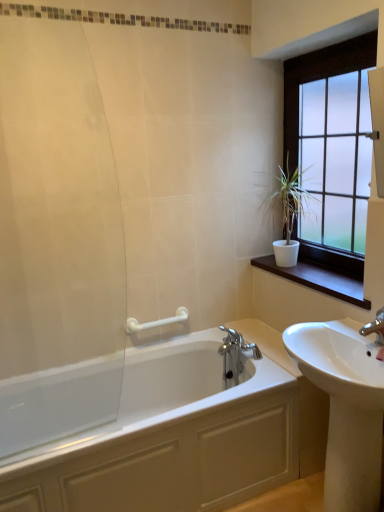
Question: Is white glossy bathtub at lower left not inside white wood at right?

Choices:
 (A) yes
 (B) no

Answer: (A)

Question: Considering the relative sizes of white glossy bathtub at lower left and white wood at right in the image provided, is white glossy bathtub at lower left bigger than white wood at right?

Choices:
 (A) no
 (B) yes

Answer: (B)

Question: Is white glossy bathtub at lower left wider than white wood at right?

Choices:
 (A) yes
 (B) no

Answer: (A)

Question: From a real-world perspective, is white glossy bathtub at lower left below white wood at right?

Choices:
 (A) no
 (B) yes

Answer: (B)

Question: Can you confirm if white glossy bathtub at lower left is positioned to the left of white wood at right?

Choices:
 (A) yes
 (B) no

Answer: (A)

Question: Does white glossy bathtub at lower left come in front of white wood at right?

Choices:
 (A) no
 (B) yes

Answer: (B)

Question: Is transparent glass shower door at left to the right of satin glass window at upper right from the viewer's perspective?

Choices:
 (A) no
 (B) yes

Answer: (A)

Question: Considering the relative sizes of transparent glass shower door at left and satin glass window at upper right in the image provided, is transparent glass shower door at left taller than satin glass window at upper right?

Choices:
 (A) yes
 (B) no

Answer: (A)

Question: Would you say transparent glass shower door at left is a long distance from satin glass window at upper right?

Choices:
 (A) yes
 (B) no

Answer: (A)

Question: From a real-world perspective, is transparent glass shower door at left physically above satin glass window at upper right?

Choices:
 (A) yes
 (B) no

Answer: (B)

Question: From the image's perspective, would you say transparent glass shower door at left is shown under satin glass window at upper right?

Choices:
 (A) yes
 (B) no

Answer: (A)

Question: Considering the relative positions of transparent glass shower door at left and satin glass window at upper right in the image provided, is transparent glass shower door at left to the left of satin glass window at upper right from the viewer's perspective?

Choices:
 (A) no
 (B) yes

Answer: (B)

Question: Considering the relative sizes of white matte plant at upper right and transparent glass shower door at left in the image provided, is white matte plant at upper right shorter than transparent glass shower door at left?

Choices:
 (A) no
 (B) yes

Answer: (B)